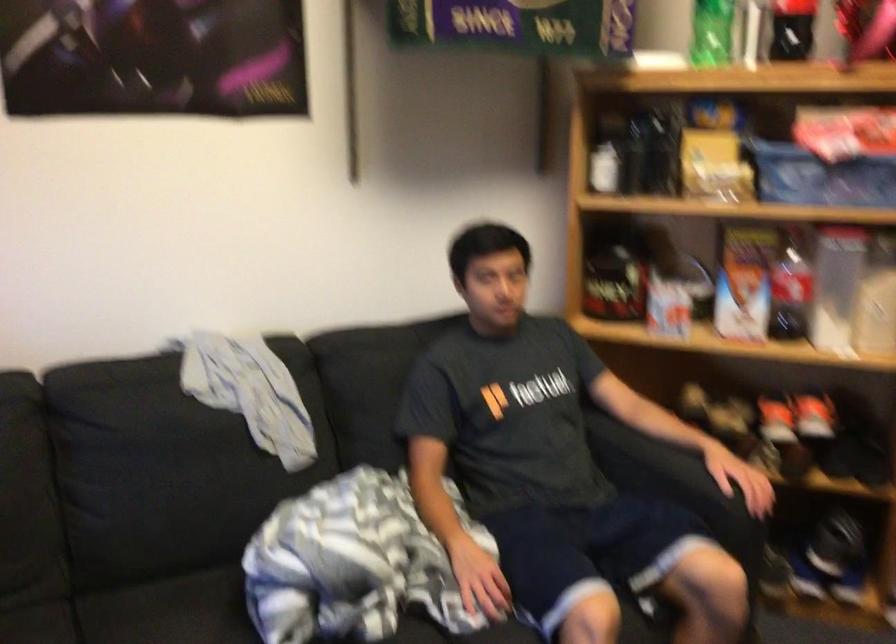
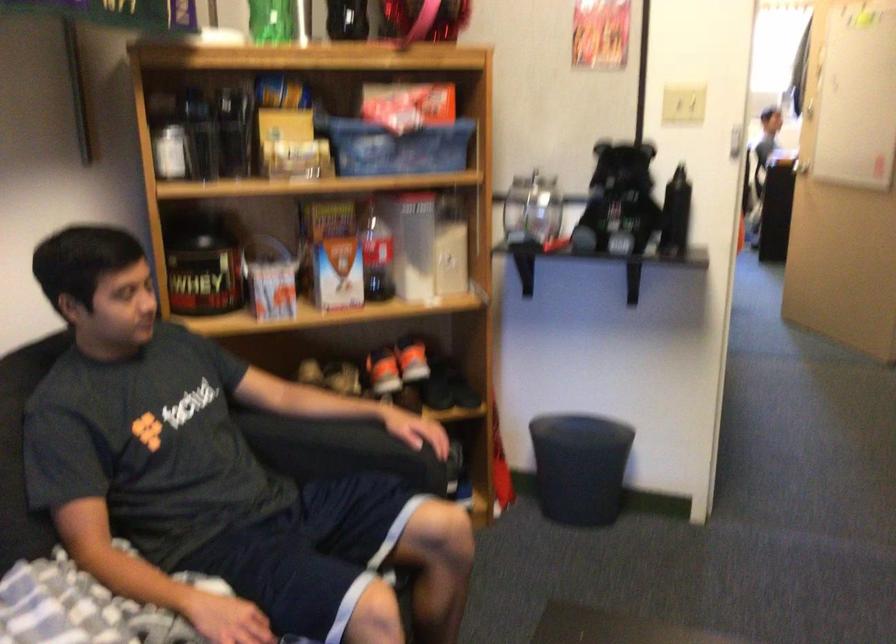
The point at (652, 460) is marked in the first image. Where is the corresponding point in the second image?

(330, 444)